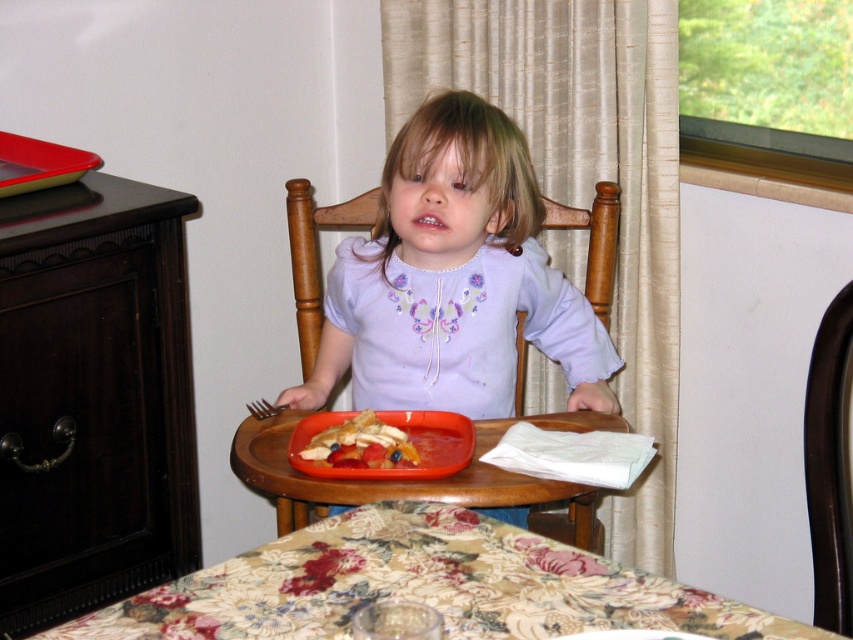
Question: Which object is the closest to the wooden chair at center?

Choices:
 (A) dark brown wood chair at center
 (B) metallic fork at lower left
 (C) smooth plastic tray at center

Answer: (B)

Question: Which object is closer to the camera taking this photo?

Choices:
 (A) wooden tray at center
 (B) metallic fork at lower left
 (C) floral fabric table at center
 (D) dark wood dresser at left

Answer: (C)

Question: Can you confirm if wooden chair at center is thinner than smooth plastic tray at center?

Choices:
 (A) no
 (B) yes

Answer: (A)

Question: Is the position of floral fabric table at center less distant than that of smooth plastic tray at center?

Choices:
 (A) no
 (B) yes

Answer: (B)

Question: Which of the following is the closest to the observer?

Choices:
 (A) (88, 486)
 (B) (373, 417)
 (C) (325, 481)

Answer: (C)

Question: Does floral fabric table at center come behind dark brown wood chair at center?

Choices:
 (A) yes
 (B) no

Answer: (B)